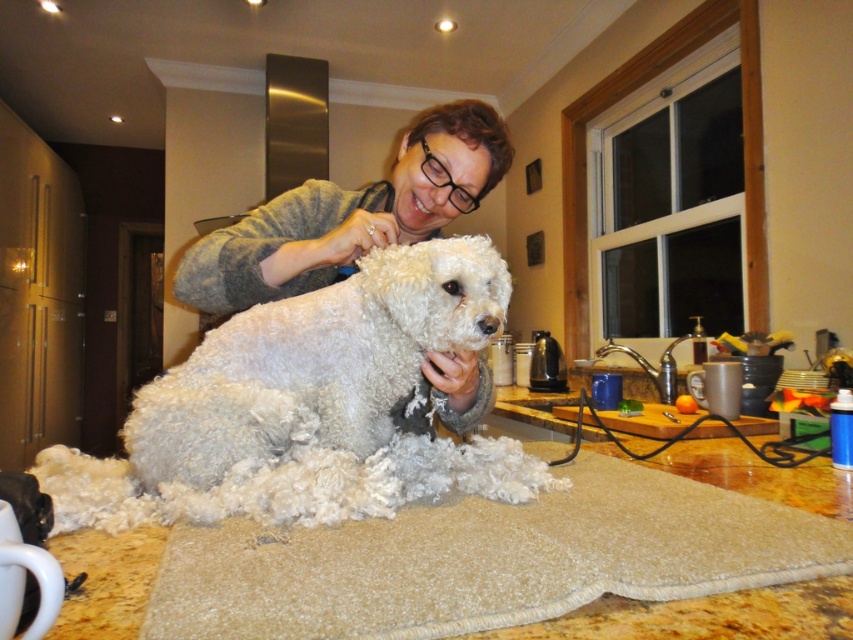
How far apart are white fluffy dog at center and matte gray sweater at center?

white fluffy dog at center is 5.57 inches from matte gray sweater at center.

From the picture: Between white fluffy dog at center and matte gray sweater at center, which one appears on the left side from the viewer's perspective?

Positioned to the left is white fluffy dog at center.

At what (x,y) coordinates should I click in order to perform the action: click on white fluffy dog at center. Please return your answer as a coordinate pair (x, y). This screenshot has height=640, width=853. Looking at the image, I should click on (317, 362).

Does beige carpet at lower center have a lesser height compared to white fluffy dog at center?

Indeed, beige carpet at lower center has a lesser height compared to white fluffy dog at center.

Is point (204, 545) positioned in front of point (366, 420)?

Yes, point (204, 545) is in front of point (366, 420).

Measure the distance between point (161, 576) and camera.

56.28 centimeters

This screenshot has width=853, height=640. What are the coordinates of `beige carpet at lower center` in the screenshot? It's located at (488, 560).

Is beige carpet at lower center closer to the viewer compared to matte gray sweater at center?

Yes.

Does point (315, 618) come closer to viewer compared to point (368, 189)?

Yes.

Image resolution: width=853 pixels, height=640 pixels. I want to click on beige carpet at lower center, so click(x=488, y=560).